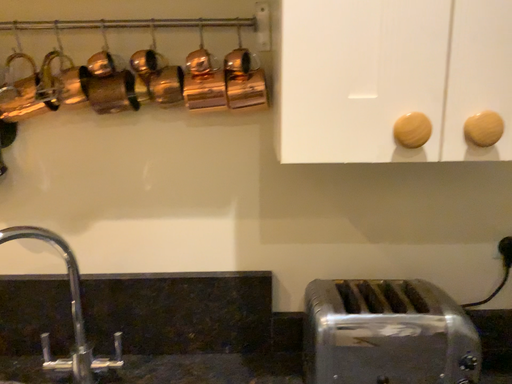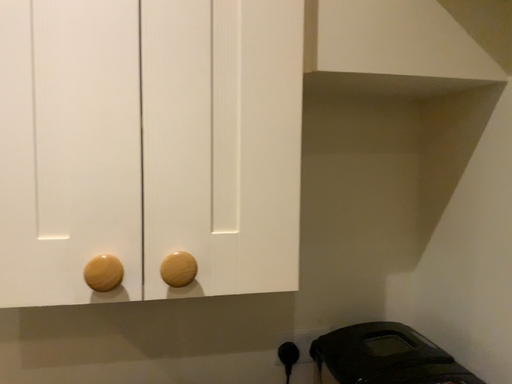
Question: Which way did the camera rotate in the video?

Choices:
 (A) rotated downward
 (B) rotated upward

Answer: (B)